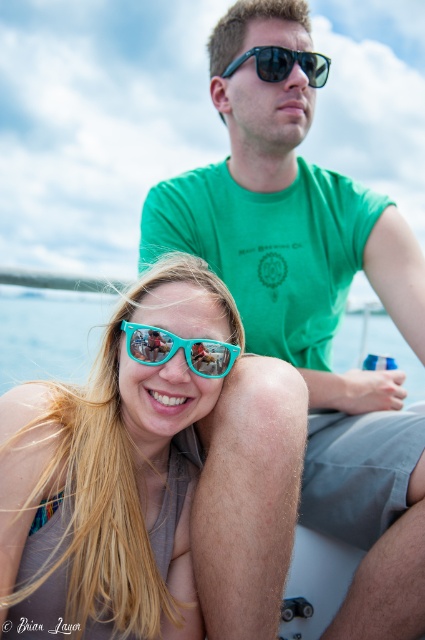
Question: Which object appears closest to the camera in this image?

Choices:
 (A) sunglasses at upper center
 (B) teal plastic sunglasses at center
 (C) teal plastic goggles at center

Answer: (B)

Question: Where is green matte t-shirt at upper center located in relation to teal plastic sunglasses at center in the image?

Choices:
 (A) right
 (B) left

Answer: (A)

Question: Among these objects, which one is nearest to the camera?

Choices:
 (A) green matte t-shirt at upper center
 (B) teal plastic sunglasses at center

Answer: (B)

Question: Is green matte t-shirt at upper center smaller than teal plastic sunglasses at center?

Choices:
 (A) no
 (B) yes

Answer: (A)

Question: Which is nearer to the green matte t-shirt at upper center?

Choices:
 (A) teal plastic sunglasses at center
 (B) sunglasses at upper center
 (C) teal plastic goggles at center

Answer: (B)

Question: Can you confirm if green matte t-shirt at upper center is positioned to the right of teal plastic sunglasses at center?

Choices:
 (A) no
 (B) yes

Answer: (B)